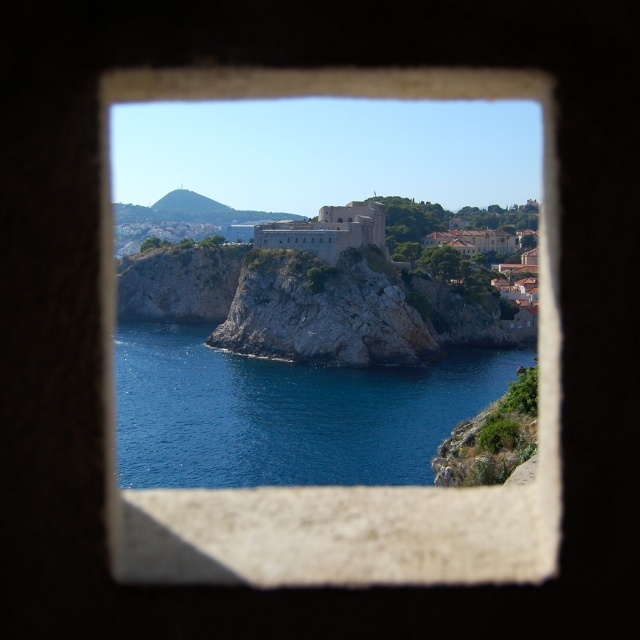
Is blue water at center below rocky cliff at center?

Yes.

Is blue water at center shorter than rocky cliff at center?

Indeed, blue water at center has a lesser height compared to rocky cliff at center.

The height and width of the screenshot is (640, 640). Describe the element at coordinates (285, 412) in the screenshot. I see `blue water at center` at that location.

This screenshot has width=640, height=640. What are the coordinates of `blue water at center` in the screenshot? It's located at (285, 412).

Where is `smooth stone window at center`? The image size is (640, 640). smooth stone window at center is located at coordinates (342, 486).

From the picture: Can you confirm if smooth stone window at center is shorter than rocky cliff at center?

In fact, smooth stone window at center may be taller than rocky cliff at center.

Find the location of a particular element. This screenshot has width=640, height=640. smooth stone window at center is located at coordinates (342, 486).

This screenshot has height=640, width=640. Find the location of `smooth stone window at center`. smooth stone window at center is located at coordinates (342, 486).

Between point (371, 316) and point (320, 241), which one is positioned behind?

The point (320, 241) is more distant.

Is rocky cliff at center positioned behind gray stone fort at center?

No, it is not.

The height and width of the screenshot is (640, 640). Describe the element at coordinates (324, 310) in the screenshot. I see `rocky cliff at center` at that location.

Find the location of a particular element. The height and width of the screenshot is (640, 640). rocky cliff at center is located at coordinates (324, 310).